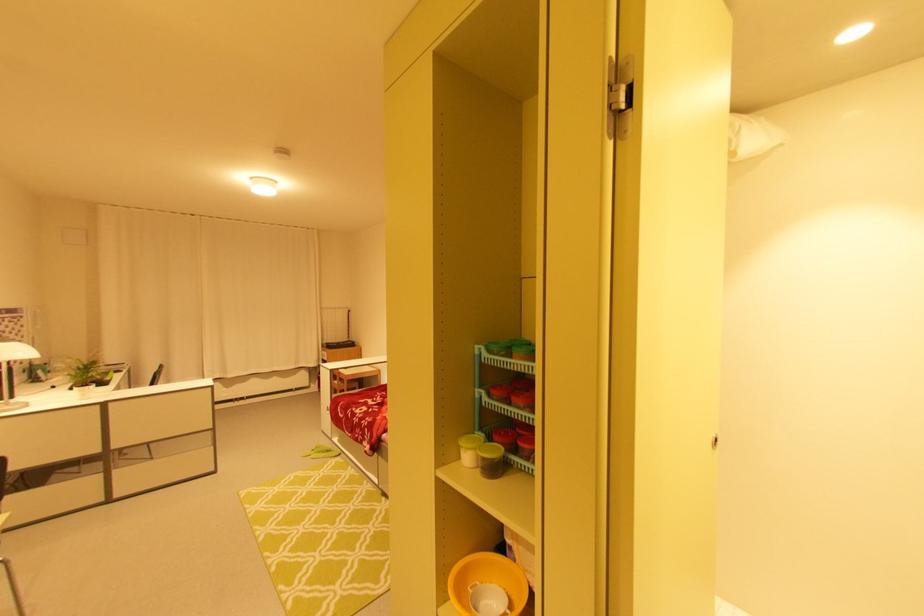
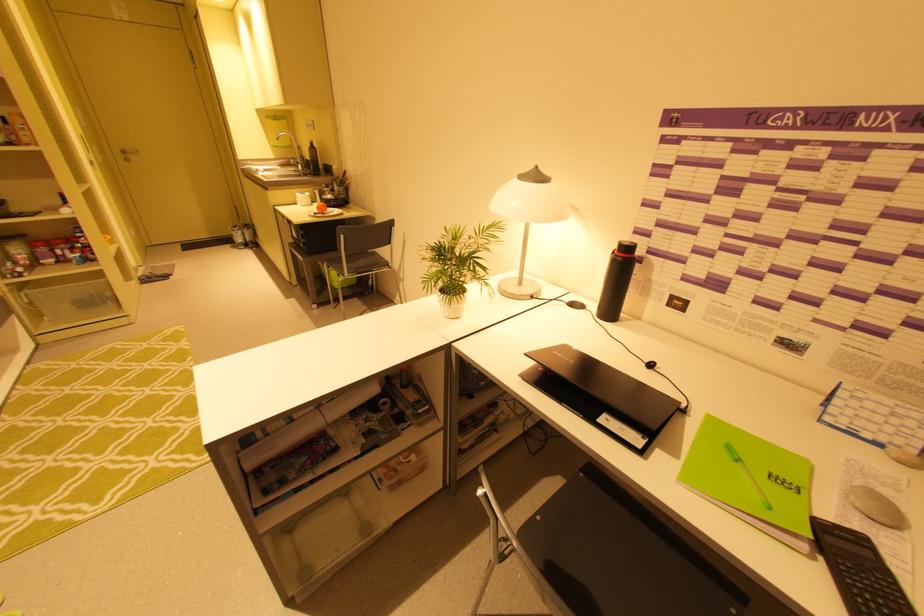
In the second image, find the point that corresponds to (x=114, y=381) in the first image.

(596, 419)